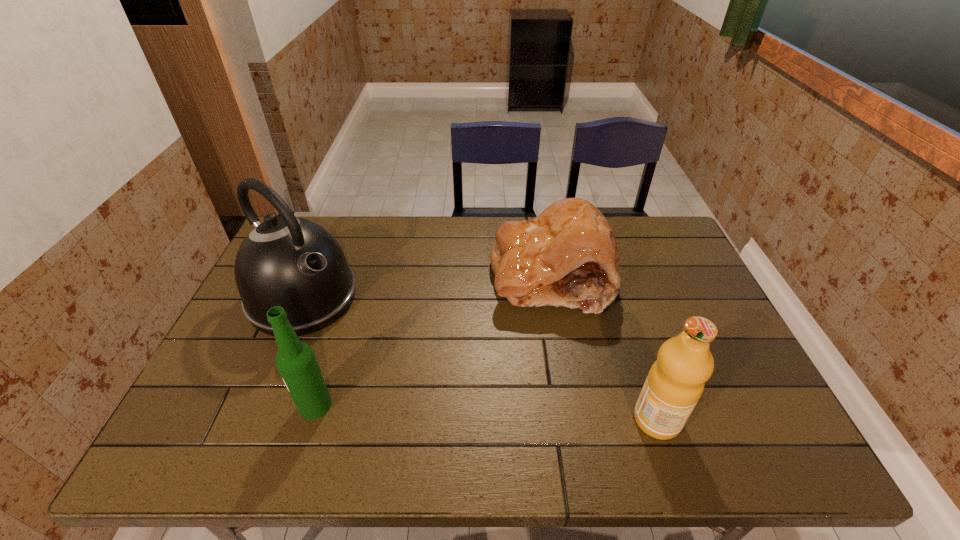
The image size is (960, 540). Find the location of `free space on the desktop that is between the beer bottle and the fruit juice and is positioned on the filling side of the shortest object`. free space on the desktop that is between the beer bottle and the fruit juice and is positioned on the filling side of the shortest object is located at coordinates (445, 411).

At what (x,y) coordinates should I click in order to perform the action: click on vacant space on the desktop that is between the beer bottle and the fruit juice and is positioned on the spout of the tallest object. Please return your answer as a coordinate pair (x, y). Looking at the image, I should click on click(x=451, y=411).